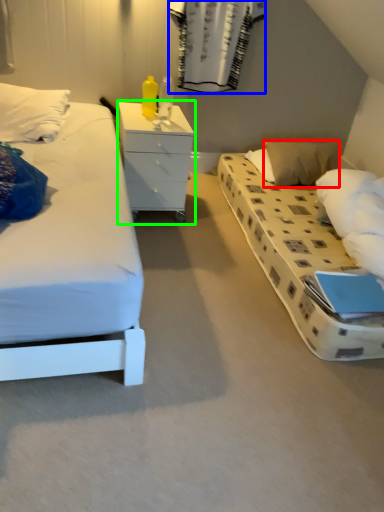
Question: Which object is positioned closest to pillow (highlighted by a red box)? Select from curtain (highlighted by a blue box) and chest of drawers (highlighted by a green box).

Choices:
 (A) curtain
 (B) chest of drawers

Answer: (A)